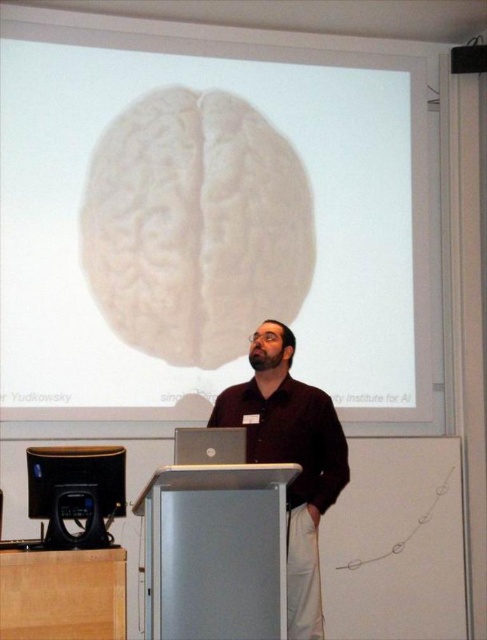
You are an event organizer who needs to adjust the seating arrangement for a VIP guest. The guest requires a chair that is 32 inches wide. You see the dark brown shirt at center and the black glossy monitor at lower left. Can the guest sit between these two items without their chair overlapping either object?

The dark brown shirt at center and black glossy monitor at lower left are 30.48 inches apart from each other. Since the chair requires 32 inches of space, the guest cannot sit between them as the distance is insufficient.